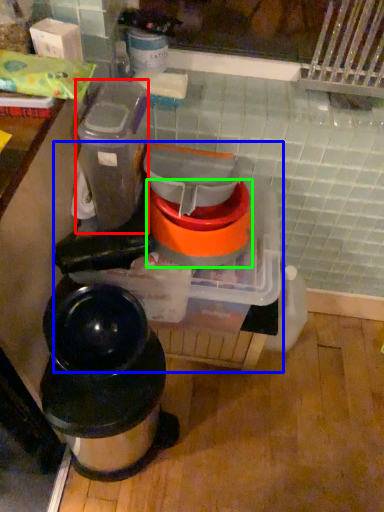
Question: Considering the real-world distances, which object is farthest from appliance (highlighted by a red box)? appliance (highlighted by a blue box) or appliance (highlighted by a green box)?

Choices:
 (A) appliance
 (B) appliance

Answer: (A)